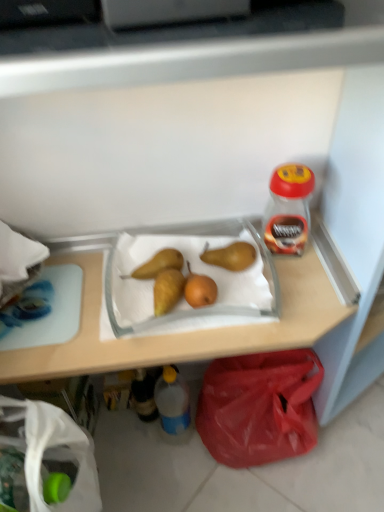
What do you see at coordinates (174, 282) in the screenshot?
I see `yellow matte pears at center` at bounding box center [174, 282].

Identify the location of brown matte pear at center, positioned as the second pear in right-to-left order. The width and height of the screenshot is (384, 512). (159, 264).

Image resolution: width=384 pixels, height=512 pixels. What do you see at coordinates (288, 209) in the screenshot? I see `translucent plastic jar at upper right, acting as the 1th bottle starting from the top` at bounding box center [288, 209].

What is the approximate width of white fabric bag at lower left?

white fabric bag at lower left is 10.11 inches wide.

Measure the distance between point (216, 251) and camera.

They are 32.99 inches apart.

What are the coordinates of `translucent plastic bottle at lower center, which ranks as the 1th bottle in left-to-right order` in the screenshot? It's located at (144, 395).

Between red plastic bag at lower right and blue translucent bottle at lower center, placed as the first bottle when sorted from bottom to top, which one appears on the left side from the viewer's perspective?

blue translucent bottle at lower center, placed as the first bottle when sorted from bottom to top.

From a real-world perspective, is red plastic bag at lower right beneath blue translucent bottle at lower center, which ranks as the 2th bottle in left-to-right order?

Correct, in the physical world, red plastic bag at lower right is lower than blue translucent bottle at lower center, which ranks as the 2th bottle in left-to-right order.

Based on the photo, is red plastic bag at lower right facing towards blue translucent bottle at lower center, which ranks as the 2th bottle in left-to-right order?

No, red plastic bag at lower right does not turn towards blue translucent bottle at lower center, which ranks as the 2th bottle in left-to-right order.

Could you tell me if blue translucent bottle at lower center, which ranks as the 2th bottle in left-to-right order, is facing translucent plastic jar at upper right, marked as the first bottle in a right-to-left arrangement?

No, blue translucent bottle at lower center, which ranks as the 2th bottle in left-to-right order, does not turn towards translucent plastic jar at upper right, marked as the first bottle in a right-to-left arrangement.

From a real-world perspective, is blue translucent bottle at lower center, which ranks as the 2th bottle in left-to-right order, positioned over translucent plastic jar at upper right, arranged as the third bottle when ordered from the bottom, based on gravity?

No, from a real-world perspective, blue translucent bottle at lower center, which ranks as the 2th bottle in left-to-right order, is not above translucent plastic jar at upper right, arranged as the third bottle when ordered from the bottom.

Measure the distance between blue translucent bottle at lower center, which ranks as the 2th bottle in left-to-right order, and translucent plastic jar at upper right, which is counted as the 3th bottle, starting from the left.

blue translucent bottle at lower center, which ranks as the 2th bottle in left-to-right order, is 22.44 inches from translucent plastic jar at upper right, which is counted as the 3th bottle, starting from the left.

Is the surface of blue translucent bottle at lower center, placed as the first bottle when sorted from bottom to top, in direct contact with translucent plastic jar at upper right, acting as the 1th bottle starting from the top?

No, blue translucent bottle at lower center, placed as the first bottle when sorted from bottom to top, is not next to translucent plastic jar at upper right, acting as the 1th bottle starting from the top.

Is white fabric bag at lower left turned away from brown matte pear at center, positioned as the second pear in right-to-left order?

white fabric bag at lower left does not have its back to brown matte pear at center, positioned as the second pear in right-to-left order.

Which point is more distant from viewer, (33, 413) or (147, 263)?

The point (147, 263) is farther.

Find the location of `grocery bag below the brown matte pear at center, positioned as the second pear in right-to-left order (from a real-world perspective)`. grocery bag below the brown matte pear at center, positioned as the second pear in right-to-left order (from a real-world perspective) is located at coordinates (54, 453).

In terms of width, does white fabric bag at lower left look wider or thinner when compared to brown matte pear at center, positioned as the second pear in right-to-left order?

Considering their sizes, white fabric bag at lower left looks broader than brown matte pear at center, positioned as the second pear in right-to-left order.

From the picture: In terms of height, does brown matte pear at center, acting as the first pear starting from the right, look taller or shorter compared to translucent plastic jar at upper right, marked as the first bottle in a right-to-left arrangement?

In the image, brown matte pear at center, acting as the first pear starting from the right, appears to be shorter than translucent plastic jar at upper right, marked as the first bottle in a right-to-left arrangement.

Are brown matte pear at center, which appears as the second pear when viewed from the left, and translucent plastic jar at upper right, arranged as the third bottle when ordered from the bottom, located far from each other?

They are positioned close to each other.

From the image's perspective, which one is positioned lower, brown matte pear at center, which appears as the second pear when viewed from the left, or translucent plastic jar at upper right, acting as the 1th bottle starting from the top?

brown matte pear at center, which appears as the second pear when viewed from the left, is shown below in the image.

Does red plastic bag at lower right have a lesser width compared to brown matte pear at center, marked as the 1th pear in a left-to-right arrangement?

No.

From the picture: Between red plastic bag at lower right and brown matte pear at center, positioned as the second pear in right-to-left order, which one appears on the right side from the viewer's perspective?

Positioned to the right is red plastic bag at lower right.

From the image's perspective, does red plastic bag at lower right appear higher than brown matte pear at center, positioned as the second pear in right-to-left order?

Actually, red plastic bag at lower right appears below brown matte pear at center, positioned as the second pear in right-to-left order, in the image.

Looking at this image, between red plastic bag at lower right and brown matte pear at center, marked as the 1th pear in a left-to-right arrangement, which one has less height?

brown matte pear at center, marked as the 1th pear in a left-to-right arrangement.

Considering the relative sizes of translucent plastic bottle at lower center, the 3th bottle positioned from the right, and brown matte pear at center, marked as the 1th pear in a left-to-right arrangement, in the image provided, is translucent plastic bottle at lower center, the 3th bottle positioned from the right, thinner than brown matte pear at center, marked as the 1th pear in a left-to-right arrangement,?

Yes.

Which is less distant, (142, 372) or (175, 269)?

The point (175, 269) is closer.

Is translucent plastic bottle at lower center, the 3th bottle positioned from the right, turned away from brown matte pear at center, positioned as the second pear in right-to-left order?

That's not correct — translucent plastic bottle at lower center, the 3th bottle positioned from the right, is not looking away from brown matte pear at center, positioned as the second pear in right-to-left order.

Where is `the 1st bottle positioned below the brown matte pear at center, marked as the 1th pear in a left-to-right arrangement (from the image's perspective)`? The image size is (384, 512). the 1st bottle positioned below the brown matte pear at center, marked as the 1th pear in a left-to-right arrangement (from the image's perspective) is located at coordinates (144, 395).

Which is correct: brown matte pear at center, marked as the 1th pear in a left-to-right arrangement, is inside blue translucent bottle at lower center, which ranks as the 2th bottle in left-to-right order, or outside of it?

The correct answer is: outside.

In the image, is brown matte pear at center, positioned as the second pear in right-to-left order, positioned in front of or behind blue translucent bottle at lower center, placed as the first bottle when sorted from bottom to top?

Visually, brown matte pear at center, positioned as the second pear in right-to-left order, is located in front of blue translucent bottle at lower center, placed as the first bottle when sorted from bottom to top.

Is brown matte pear at center, marked as the 1th pear in a left-to-right arrangement, shorter than blue translucent bottle at lower center, which is the third bottle in top-to-bottom order?

Correct, brown matte pear at center, marked as the 1th pear in a left-to-right arrangement, is not as tall as blue translucent bottle at lower center, which is the third bottle in top-to-bottom order.

Where is `bottle that is the 1st object located behind the red plastic bag at lower right`? bottle that is the 1st object located behind the red plastic bag at lower right is located at coordinates (172, 401).

Identify the location of bottle on the right of blue translucent bottle at lower center, which ranks as the 2th bottle in left-to-right order. (288, 209).

From the picture: Considering their positions, is brown matte pear at center, positioned as the second pear in right-to-left order, positioned closer to yellow matte pears at center than translucent plastic bottle at lower center, the 2th bottle from the top?

Based on the image, brown matte pear at center, positioned as the second pear in right-to-left order, appears to be nearer to yellow matte pears at center.

From the image, which object appears to be nearer to translucent plastic jar at upper right, which is counted as the 3th bottle, starting from the left, yellow matte pears at center or brown matte pear at center, positioned as the second pear in right-to-left order?

Based on the image, yellow matte pears at center appears to be nearer to translucent plastic jar at upper right, which is counted as the 3th bottle, starting from the left.

Based on their spatial positions, is brown matte pear at center, positioned as the second pear in right-to-left order, or blue translucent bottle at lower center, the 2th bottle when ordered from right to left, further from yellow matte pears at center?

blue translucent bottle at lower center, the 2th bottle when ordered from right to left.

Which object lies further to the anchor point red plastic bag at lower right, white fabric bag at lower left or yellow matte pears at center?

Among the two, white fabric bag at lower left is located further to red plastic bag at lower right.

From the image, which object appears to be farther from blue translucent bottle at lower center, which is the third bottle in top-to-bottom order, white fabric bag at lower left or yellow matte pears at center?

white fabric bag at lower left lies further to blue translucent bottle at lower center, which is the third bottle in top-to-bottom order, than the other object.

Estimate the real-world distances between objects in this image. Which object is further from blue translucent bottle at lower center, which is the third bottle in top-to-bottom order, brown matte pear at center, marked as the 1th pear in a left-to-right arrangement, or yellow matte pears at center?

Among the two, brown matte pear at center, marked as the 1th pear in a left-to-right arrangement, is located further to blue translucent bottle at lower center, which is the third bottle in top-to-bottom order.

Which object lies further to the anchor point white fabric bag at lower left, brown matte pear at center, marked as the 1th pear in a left-to-right arrangement, or translucent plastic bottle at lower center, which ranks as the second bottle in bottom-to-top order?

translucent plastic bottle at lower center, which ranks as the second bottle in bottom-to-top order, lies further to white fabric bag at lower left than the other object.

Which object lies further to the anchor point translucent plastic jar at upper right, which is counted as the 3th bottle, starting from the left, translucent plastic bottle at lower center, which ranks as the second bottle in bottom-to-top order, or yellow matte pears at center?

translucent plastic bottle at lower center, which ranks as the second bottle in bottom-to-top order, is further to translucent plastic jar at upper right, which is counted as the 3th bottle, starting from the left.

Locate an element on the screen. The image size is (384, 512). fruit between brown matte pear at center, acting as the first pear starting from the right, and blue translucent bottle at lower center, placed as the first bottle when sorted from bottom to top, from top to bottom is located at coordinates (174, 282).

Identify the location of pear between brown matte pear at center, acting as the first pear starting from the right, and white fabric bag at lower left in the up-down direction. (x=159, y=264).

At what (x,y) coordinates should I click in order to perform the action: click on bottle between brown matte pear at center, positioned as the second pear in right-to-left order, and red plastic bag at lower right, in the vertical direction. Please return your answer as a coordinate pair (x, y). Looking at the image, I should click on (144, 395).

You are a GUI agent. You are given a task and a screenshot of the screen. Output one action in this format:
    pyautogui.click(x=<x>, y=<y>)
    Task: Click on the bottle between yellow matte pears at center and red plastic bag at lower right vertically
    The image size is (384, 512).
    Given the screenshot: What is the action you would take?
    pyautogui.click(x=144, y=395)